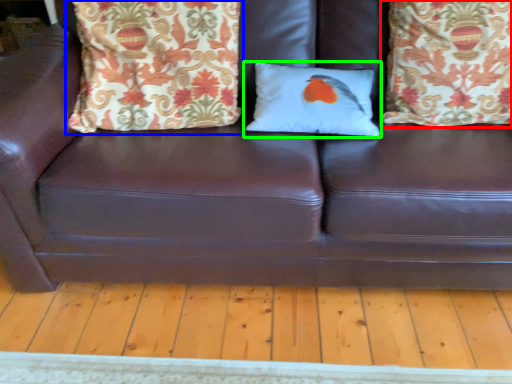
Question: Based on their relative distances, which object is farther from pillow (highlighted by a red box)? Choose from pillow (highlighted by a blue box) and pillow (highlighted by a green box).

Choices:
 (A) pillow
 (B) pillow

Answer: (A)